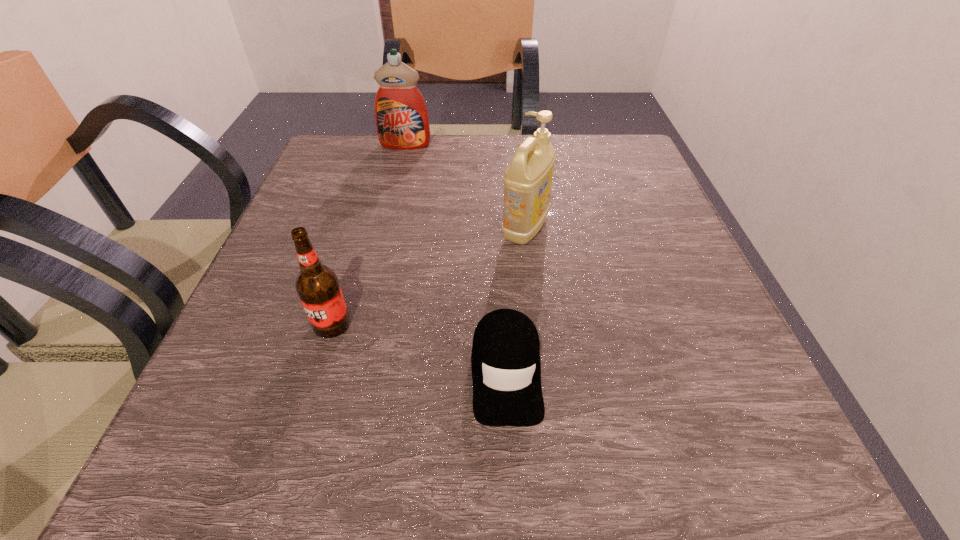
Locate an element on the screen. free space at the near right corner of the desktop is located at coordinates (692, 427).

I want to click on free space between the nearer detergent and the left detergent, so click(466, 187).

This screenshot has height=540, width=960. I want to click on free space between the nearer detergent and the farthest object, so click(x=466, y=187).

You are a GUI agent. You are given a task and a screenshot of the screen. Output one action in this format:
    pyautogui.click(x=<x>, y=<y>)
    Task: Click on the free spot between the root beer and the cap
    The height and width of the screenshot is (540, 960).
    Given the screenshot: What is the action you would take?
    pyautogui.click(x=419, y=348)

At what (x,y) coordinates should I click in order to perform the action: click on free spot between the right detergent and the farther detergent. Please return your answer as a coordinate pair (x, y). The width and height of the screenshot is (960, 540). Looking at the image, I should click on (466, 187).

You are a GUI agent. You are given a task and a screenshot of the screen. Output one action in this format:
    pyautogui.click(x=<x>, y=<y>)
    Task: Click on the free spot between the right detergent and the root beer
    This screenshot has height=540, width=960.
    Given the screenshot: What is the action you would take?
    pyautogui.click(x=428, y=276)

Locate an element on the screen. empty location between the farther detergent and the third nearest object is located at coordinates (466, 187).

At what (x,y) coordinates should I click in order to perform the action: click on vacant region between the second farthest object and the root beer. Please return your answer as a coordinate pair (x, y). Image resolution: width=960 pixels, height=540 pixels. Looking at the image, I should click on (428, 276).

I want to click on free point between the root beer and the cap, so point(419,348).

Identify the location of vacant space in between the farther detergent and the third nearest object. The image size is (960, 540). (466, 187).